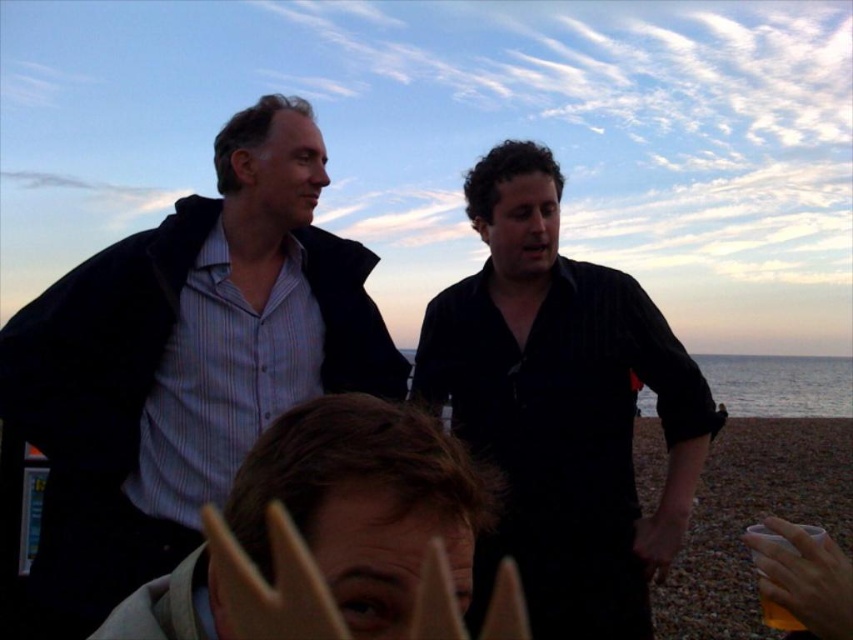
Question: Can you confirm if black matte shirt at center is positioned to the right of translucent plastic cup at lower right?

Choices:
 (A) no
 (B) yes

Answer: (A)

Question: Which point is farther to the camera?

Choices:
 (A) (820, 541)
 (B) (463, 499)
 (C) (613, 416)
 (D) (267, 266)

Answer: (C)

Question: Does matte black jacket at left lie behind black matte shirt at center?

Choices:
 (A) yes
 (B) no

Answer: (B)

Question: In this image, where is black matte shirt at center located relative to translucent plastic cup at lower right?

Choices:
 (A) left
 (B) right

Answer: (A)

Question: Which point is closer to the camera taking this photo?

Choices:
 (A) [x=811, y=528]
 (B) [x=672, y=364]

Answer: (A)

Question: Which point appears farthest from the camera in this image?

Choices:
 (A) (148, 516)
 (B) (753, 531)
 (C) (698, 461)
 (D) (248, 545)

Answer: (C)